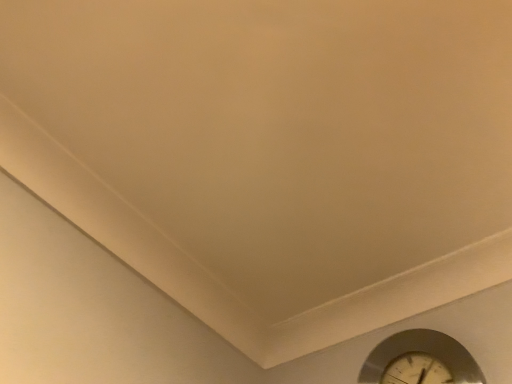
What do you see at coordinates (420, 360) in the screenshot?
I see `metallic silver clock at bottom right` at bounding box center [420, 360].

I want to click on metallic silver clock at bottom right, so click(x=420, y=360).

At what (x,y) coordinates should I click in order to perform the action: click on metallic silver clock at bottom right. Please return your answer as a coordinate pair (x, y). This screenshot has width=512, height=384. Looking at the image, I should click on (420, 360).